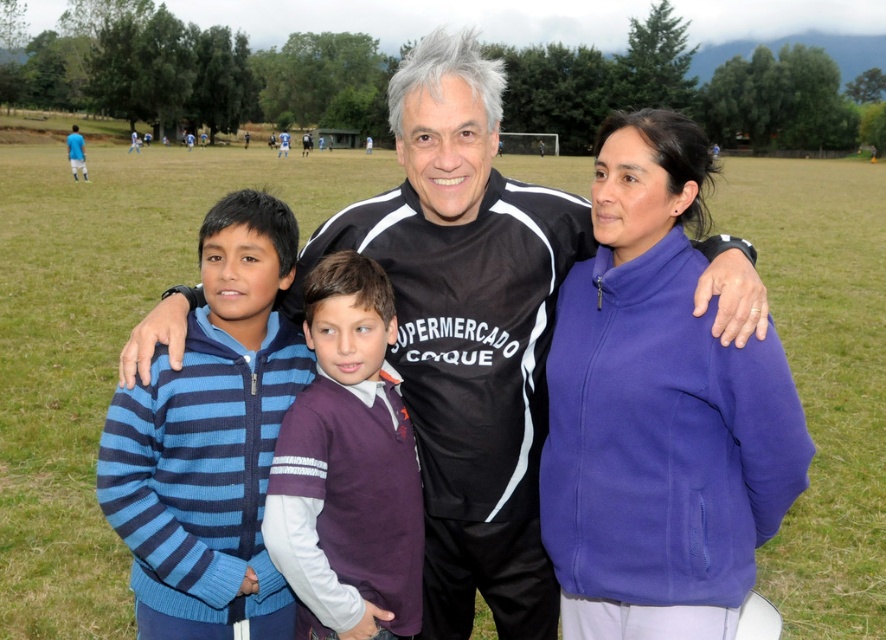
Does purple fleece jacket at right appear on the right side of blue striped sweater at center?

Correct, you'll find purple fleece jacket at right to the right of blue striped sweater at center.

Which is above, purple fleece jacket at right or blue striped sweater at center?

Positioned higher is purple fleece jacket at right.

Image resolution: width=886 pixels, height=640 pixels. What do you see at coordinates (658, 412) in the screenshot?
I see `purple fleece jacket at right` at bounding box center [658, 412].

Where is `purple fleece jacket at right`? The width and height of the screenshot is (886, 640). purple fleece jacket at right is located at coordinates (658, 412).

Does blue striped sweater at center appear over purple fleece sweater at center?

Yes, blue striped sweater at center is above purple fleece sweater at center.

Consider the image. Who is more forward, [211,428] or [372,442]?

Positioned in front is point [211,428].

I want to click on blue striped sweater at center, so click(210, 440).

Is purple fleece jacket at right below black matte shirt at center?

Yes, purple fleece jacket at right is below black matte shirt at center.

Who is positioned more to the right, purple fleece jacket at right or black matte shirt at center?

From the viewer's perspective, purple fleece jacket at right appears more on the right side.

This screenshot has height=640, width=886. I want to click on purple fleece jacket at right, so click(x=658, y=412).

Image resolution: width=886 pixels, height=640 pixels. Identify the location of purple fleece jacket at right. (658, 412).